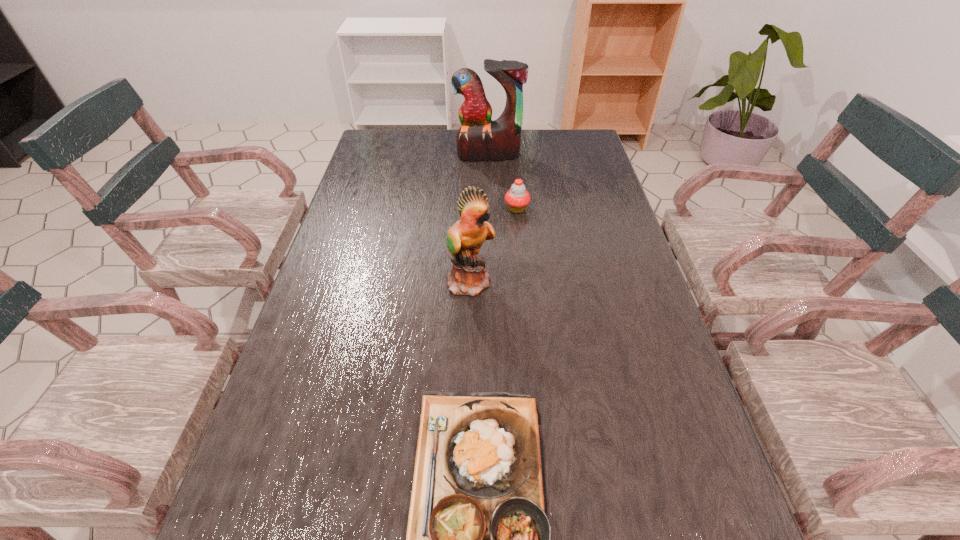
You are a GUI agent. You are given a task and a screenshot of the screen. Output one action in this format:
    pyautogui.click(x=<x>, y=<y>)
    Task: Click on the farthest object
    Image resolution: width=960 pixels, height=540 pixels.
    Given the screenshot: What is the action you would take?
    pyautogui.click(x=479, y=138)

Locate an element on the screen. The height and width of the screenshot is (540, 960). the nearer parrot is located at coordinates (468, 276).

Locate an element on the screen. This screenshot has height=540, width=960. the second shortest object is located at coordinates (517, 198).

This screenshot has height=540, width=960. Identify the location of cupcake. (517, 198).

Locate an element on the screen. blank space located 0.050m at the face of the farthest object is located at coordinates (489, 171).

This screenshot has height=540, width=960. I want to click on free spot located on the front-facing side of the nearer parrot, so click(573, 281).

Where is `free space located on the front of the cupcake`? The width and height of the screenshot is (960, 540). free space located on the front of the cupcake is located at coordinates (522, 261).

The width and height of the screenshot is (960, 540). What are the coordinates of `object located in the far edge section of the desktop` in the screenshot? It's located at (479, 138).

I want to click on free space at the far edge, so click(x=440, y=157).

This screenshot has width=960, height=540. In the image, there is a desktop. Identify the location of vacant space at the left edge. (331, 436).